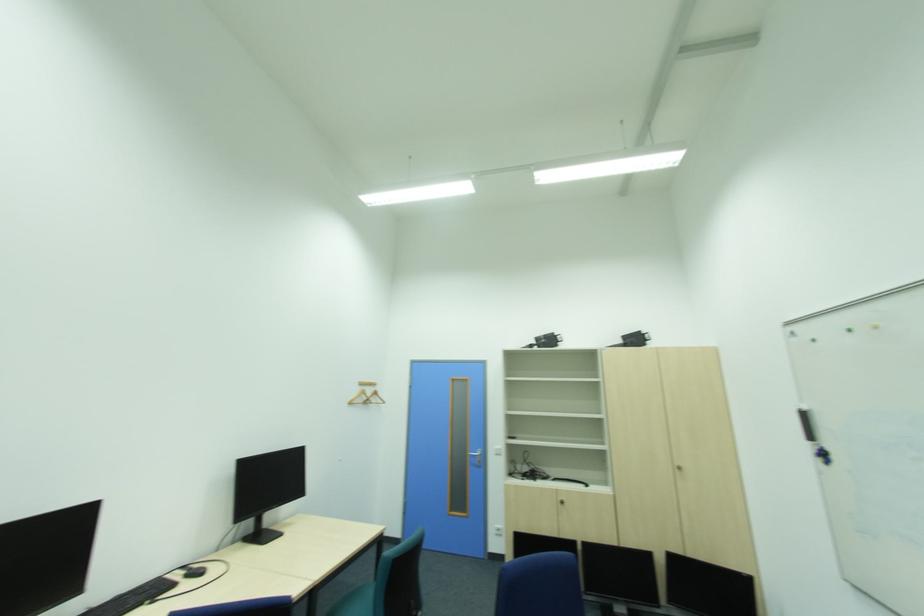
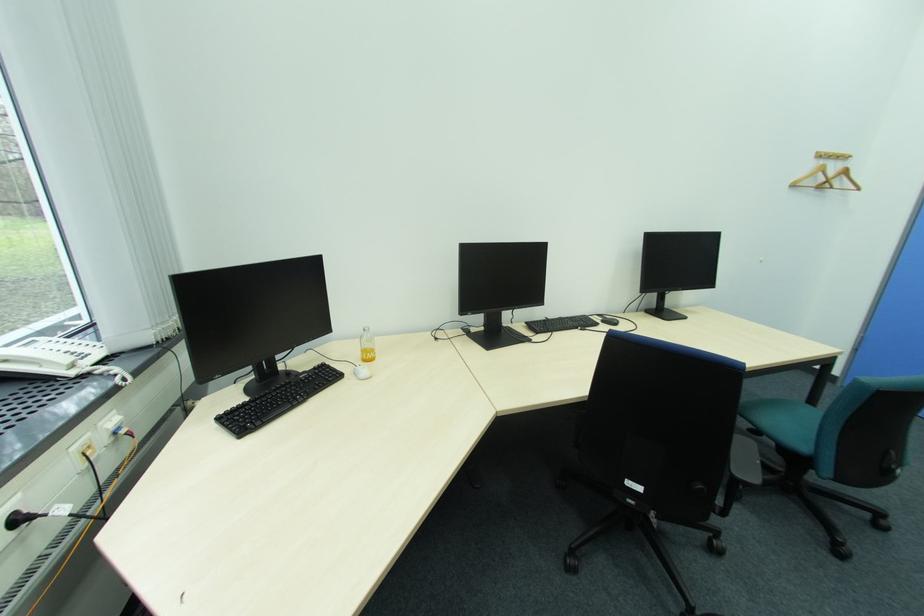
Where in the second image is the point corresponding to (367,390) from the first image?

(819, 164)